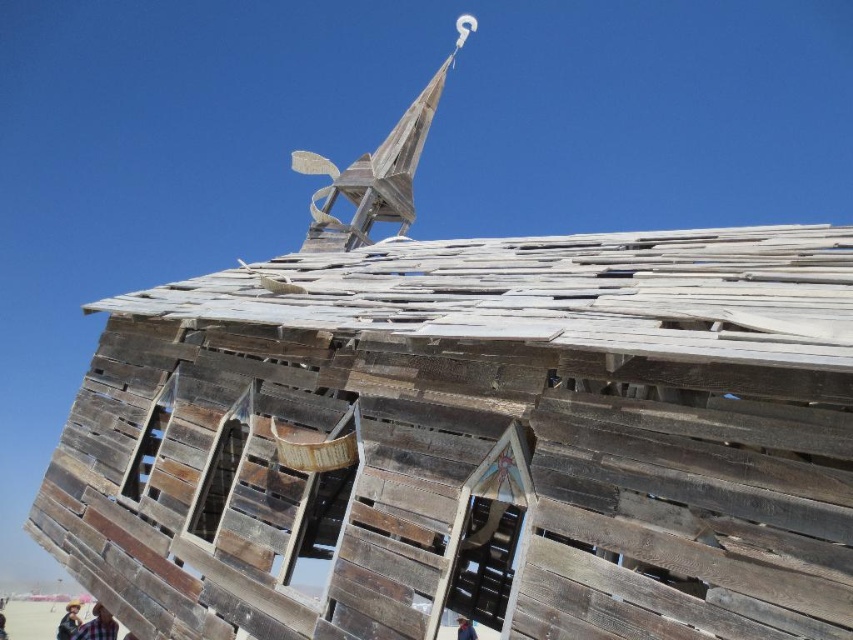
You are an artist standing at the base of the wooden structure. You notice the wooden planks at lower left and the dark blue fabric at lower left. Which object is positioned higher from the ground?

The wooden planks at lower left is above dark blue fabric at lower left, so the wooden planks at lower left is higher from the ground.